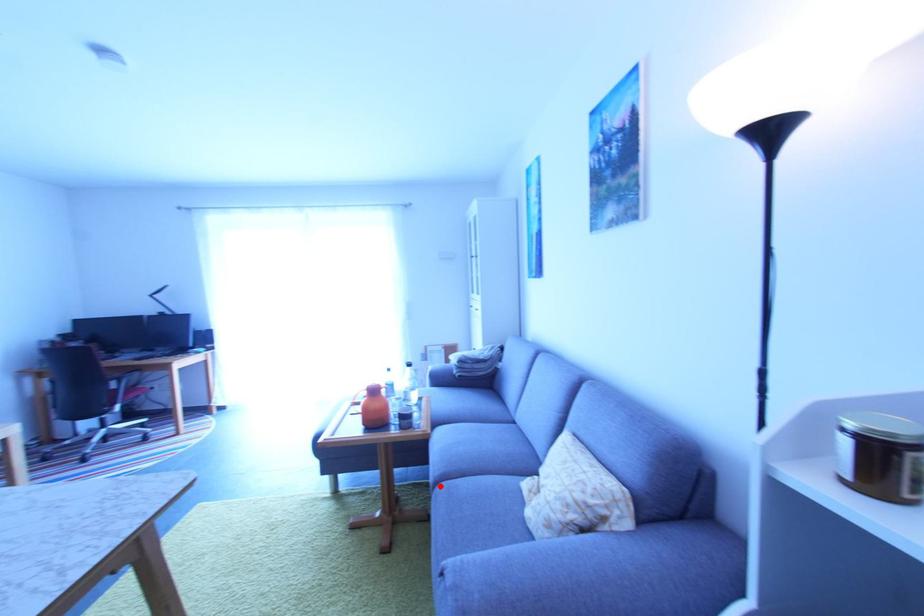
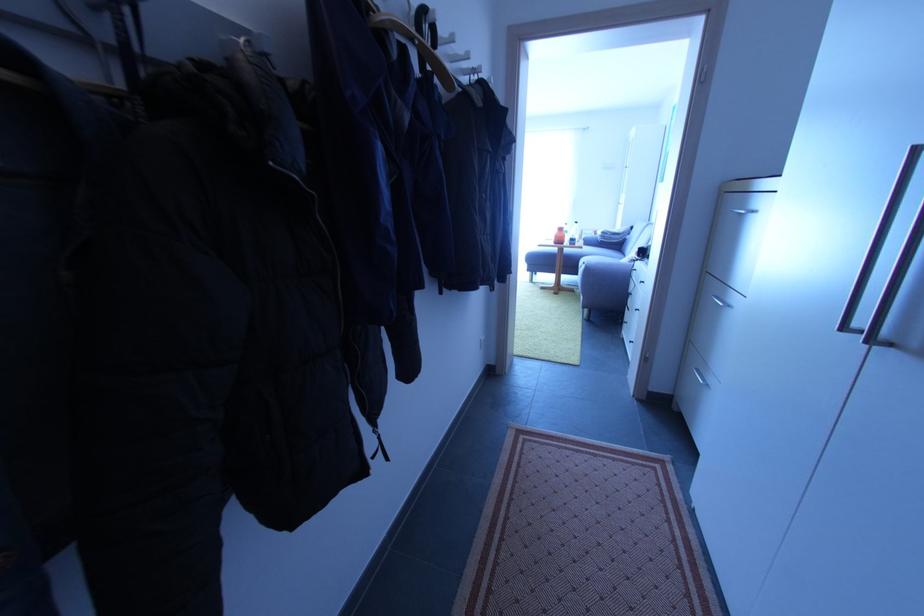
Question: I am providing you with two images of the same scene from different viewpoints. In image1, a red point is highlighted. Considering the same 3D point in image2, which of the following is correct?

Choices:
 (A) It is closer
 (B) It is farther

Answer: (A)